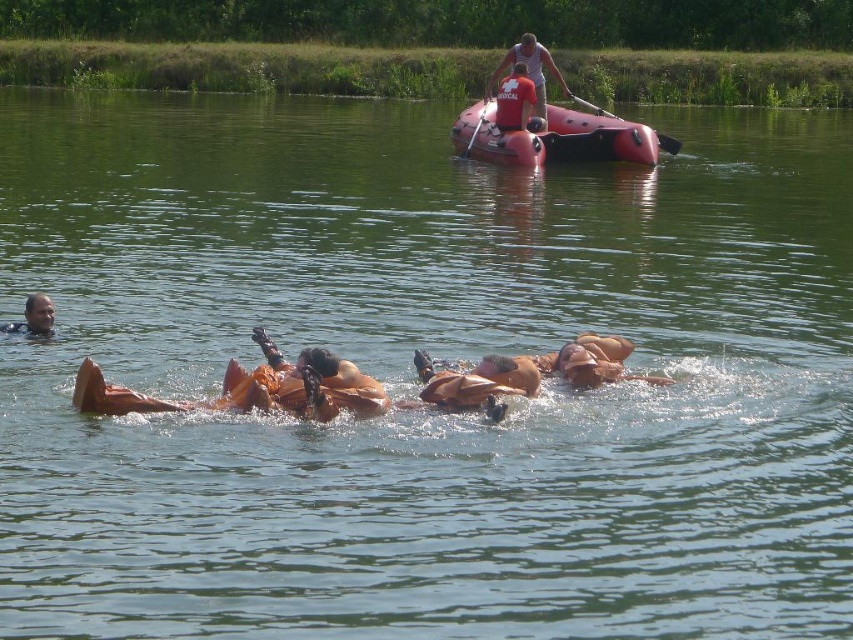
Question: Estimate the real-world distances between objects in this image. Which object is closer to the matte orange life vest at lower left?

Choices:
 (A) red matte life jacket at upper center
 (B) metallic silver paddle at upper center

Answer: (A)

Question: Which point is closer to the camera taking this photo?

Choices:
 (A) (572, 97)
 (B) (486, 106)
 (C) (45, 312)
 (D) (469, 124)

Answer: (C)

Question: Can you confirm if matte red life vest at upper center is positioned to the right of red matte life jacket at upper center?

Choices:
 (A) no
 (B) yes

Answer: (B)

Question: Does red matte life jacket at upper center appear under matte orange life vest at lower left?

Choices:
 (A) yes
 (B) no

Answer: (B)

Question: Which object is the closest to the rubberized red boat at upper center?

Choices:
 (A) matte orange life vest at lower left
 (B) rubber paddle at upper center
 (C) red matte life jacket at upper center
 (D) metallic silver paddle at upper center

Answer: (C)

Question: Is rubberized red boat at upper center thinner than matte orange life vest at lower left?

Choices:
 (A) no
 (B) yes

Answer: (A)